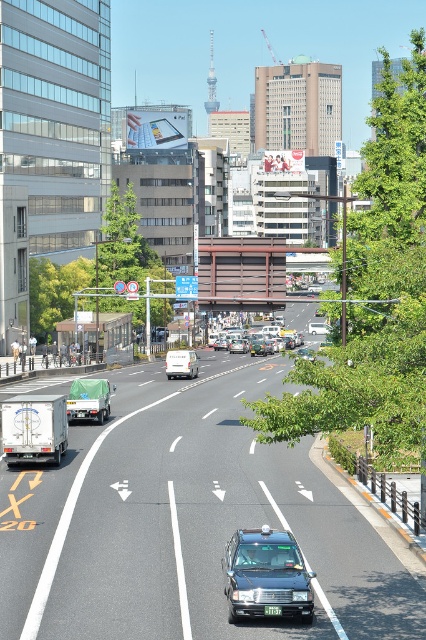
Question: Does white matte van at center have a larger size compared to green plastic license plate at center?

Choices:
 (A) no
 (B) yes

Answer: (B)

Question: Observing the image, what is the correct spatial positioning of white matte van at center in reference to green plastic license plate at center?

Choices:
 (A) right
 (B) left

Answer: (B)

Question: Which point is closer to the camera taking this photo?

Choices:
 (A) (x=258, y=545)
 (B) (x=271, y=605)
 (C) (x=311, y=324)

Answer: (B)

Question: Considering the real-world distances, which object is farthest from the white matte van at center?

Choices:
 (A) silver metallic sedan at center
 (B) metallic silver sedan at center
 (C) black glossy sedan at center

Answer: (C)

Question: Among these objects, which one is farthest from the camera?

Choices:
 (A) shiny black sedan at center
 (B) silver metallic sedan at center
 (C) black glossy sedan at center

Answer: (C)

Question: Observing the image, what is the correct spatial positioning of metallic silver sedan at center in reference to green plastic license plate at center?

Choices:
 (A) above
 (B) below

Answer: (A)